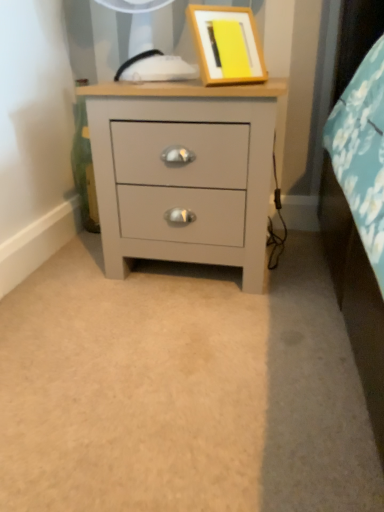
Where is `wooden picture frame at upper center`? Image resolution: width=384 pixels, height=512 pixels. wooden picture frame at upper center is located at coordinates (227, 45).

The width and height of the screenshot is (384, 512). What do you see at coordinates (227, 45) in the screenshot? I see `wooden picture frame at upper center` at bounding box center [227, 45].

What do you see at coordinates (183, 172) in the screenshot? I see `matte gray chest of drawers at center` at bounding box center [183, 172].

You are a GUI agent. You are given a task and a screenshot of the screen. Output one action in this format:
    pyautogui.click(x=<x>, y=<y>)
    Task: Click on the matte gray chest of drawers at center
    The image size is (384, 512).
    Given the screenshot: What is the action you would take?
    pyautogui.click(x=183, y=172)

Locate an element on the screen. Image resolution: width=384 pixels, height=512 pixels. wooden picture frame at upper center is located at coordinates (227, 45).

Which object is positioned more to the left, matte gray chest of drawers at center or wooden picture frame at upper center?

Positioned to the left is matte gray chest of drawers at center.

Is matte gray chest of drawers at center behind wooden picture frame at upper center?

That is True.

Considering the positions of points (148, 223) and (240, 57), is point (148, 223) closer to camera compared to point (240, 57)?

No, (148, 223) is further to viewer.

From the image's perspective, would you say matte gray chest of drawers at center is shown under wooden picture frame at upper center?

Indeed, from the image's perspective, matte gray chest of drawers at center is shown beneath wooden picture frame at upper center.

From a real-world perspective, which is physically above, matte gray chest of drawers at center or wooden picture frame at upper center?

wooden picture frame at upper center is physically above.

Which object is wider, matte gray chest of drawers at center or wooden picture frame at upper center?

matte gray chest of drawers at center is wider.

Between matte gray chest of drawers at center and wooden picture frame at upper center, which one has less height?

wooden picture frame at upper center.

In the scene shown: Does matte gray chest of drawers at center have a smaller size compared to wooden picture frame at upper center?

Incorrect, matte gray chest of drawers at center is not smaller in size than wooden picture frame at upper center.

Is matte gray chest of drawers at center outside of wooden picture frame at upper center?

matte gray chest of drawers at center is positioned outside wooden picture frame at upper center.

Would you consider matte gray chest of drawers at center to be distant from wooden picture frame at upper center?

That's not correct — matte gray chest of drawers at center is a little close to wooden picture frame at upper center.

Looking at this image, is matte gray chest of drawers at center turned away from wooden picture frame at upper center?

matte gray chest of drawers at center does not have its back to wooden picture frame at upper center.

How different are the orientations of matte gray chest of drawers at center and wooden picture frame at upper center in degrees?

45.3 degrees.

Measure the distance between matte gray chest of drawers at center and wooden picture frame at upper center.

A distance of 8.82 inches exists between matte gray chest of drawers at center and wooden picture frame at upper center.

Locate an element on the screen. picture frame that appears above the matte gray chest of drawers at center (from a real-world perspective) is located at coordinates (227, 45).

Which is more to the right, wooden picture frame at upper center or matte gray chest of drawers at center?

wooden picture frame at upper center.

In the image, is wooden picture frame at upper center positioned in front of or behind matte gray chest of drawers at center?

Visually, wooden picture frame at upper center is located in front of matte gray chest of drawers at center.

Which is in front, point (242, 63) or point (140, 131)?

The point (242, 63) is in front.

From the image's perspective, between wooden picture frame at upper center and matte gray chest of drawers at center, who is located below?

From the image's view, matte gray chest of drawers at center is below.

From a real-world perspective, who is located lower, wooden picture frame at upper center or matte gray chest of drawers at center?

From a 3D spatial view, matte gray chest of drawers at center is below.

Does wooden picture frame at upper center have a greater width compared to matte gray chest of drawers at center?

No.

Which of these two, wooden picture frame at upper center or matte gray chest of drawers at center, stands taller?

With more height is matte gray chest of drawers at center.

Is wooden picture frame at upper center bigger than matte gray chest of drawers at center?

Actually, wooden picture frame at upper center might be smaller than matte gray chest of drawers at center.

Is wooden picture frame at upper center surrounding matte gray chest of drawers at center?

No, matte gray chest of drawers at center is not a part of wooden picture frame at upper center.

Is wooden picture frame at upper center in contact with matte gray chest of drawers at center?

There is a gap between wooden picture frame at upper center and matte gray chest of drawers at center.

Is wooden picture frame at upper center oriented away from matte gray chest of drawers at center?

No, wooden picture frame at upper center is not facing the opposite direction of matte gray chest of drawers at center.

What's the angular difference between wooden picture frame at upper center and matte gray chest of drawers at center's facing directions?

The angle between the facing direction of wooden picture frame at upper center and the facing direction of matte gray chest of drawers at center is 45.3 degrees.

I want to click on chest of drawers that is on the left side of wooden picture frame at upper center, so click(x=183, y=172).

You are a GUI agent. You are given a task and a screenshot of the screen. Output one action in this format:
    pyautogui.click(x=<x>, y=<y>)
    Task: Click on the chest of drawers below the wooden picture frame at upper center (from the image's perspective)
    This screenshot has height=512, width=384.
    Given the screenshot: What is the action you would take?
    pyautogui.click(x=183, y=172)

This screenshot has height=512, width=384. In the image, there is a matte gray chest of drawers at center. In order to click on picture frame above it (from the image's perspective) in this screenshot , I will do `click(227, 45)`.